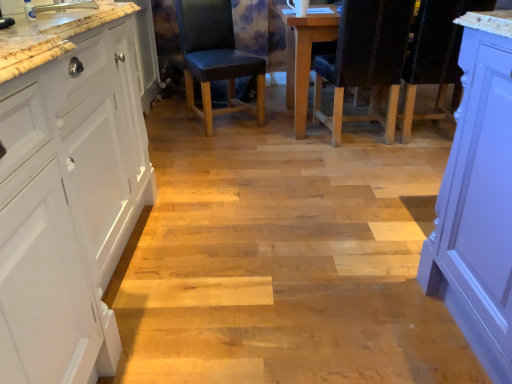
This screenshot has height=384, width=512. I want to click on vacant space in front of black leather chair at center, arranged as the first chair when viewed from the right, so click(372, 166).